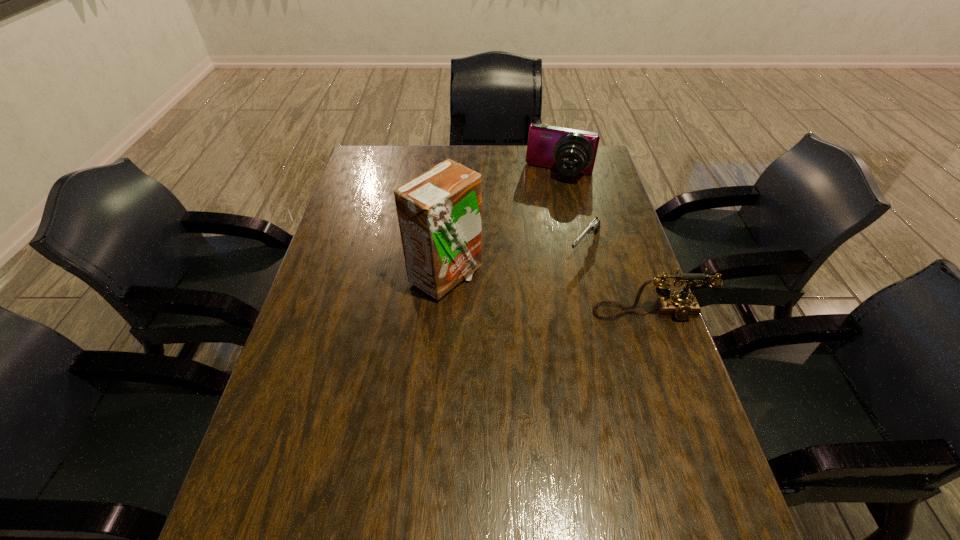
Image resolution: width=960 pixels, height=540 pixels. Identify the location of the tallest object. (439, 212).

Where is `telephone`? The image size is (960, 540). telephone is located at coordinates (682, 306).

Find the location of a particular element. the farthest object is located at coordinates (571, 151).

Identify the location of the shortest object. This screenshot has width=960, height=540. (594, 226).

I want to click on pinecone, so click(427, 169).

You are a GUI agent. You are given a task and a screenshot of the screen. Output one action in this format:
    pyautogui.click(x=<x>, y=<y>)
    Task: Click on the blank space located 0.160m on the straw side of the tallest object
    Image resolution: width=960 pixels, height=540 pixels.
    Given the screenshot: What is the action you would take?
    pyautogui.click(x=539, y=276)

Find the location of a particular element. Image resolution: width=960 pixels, height=540 pixels. free space located 0.230m on the front-facing side of the telephone is located at coordinates (683, 406).

I want to click on vacant space located on the front-facing side of the camera, so click(x=542, y=213).

The image size is (960, 540). Find the location of `blank space located on the front-facing side of the camera`. blank space located on the front-facing side of the camera is located at coordinates pyautogui.click(x=540, y=218).

At what (x,y) coordinates should I click in order to perform the action: click on free spot located on the front-facing side of the camera. Please return your answer as a coordinate pair (x, y). Image resolution: width=960 pixels, height=540 pixels. Looking at the image, I should click on 531,244.